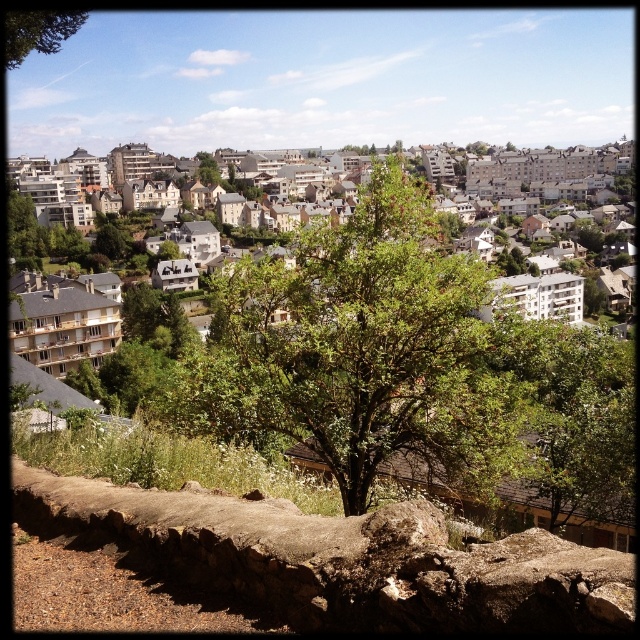
You are standing in front of the stone wall and want to walk towards the green leafy tree at center. Which direction should you turn to avoid the green leafy tree at upper left?

To reach the green leafy tree at center while avoiding the green leafy tree at upper left, you should turn to your right since the green leafy tree at center is positioned to the right of the green leafy tree at upper left.